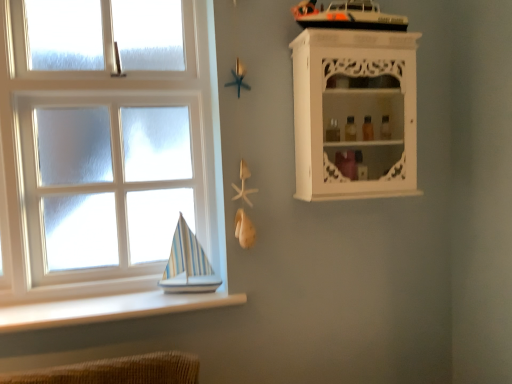
This screenshot has width=512, height=384. Identify the location of vacant space situated above white smooth ledge at lower left (from a real-world perspective). (100, 297).